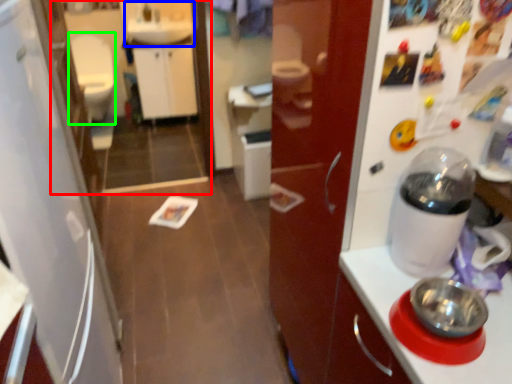
Question: Estimate the real-world distances between objects in this image. Which object is farther from mirror (highlighted by a red box), sink (highlighted by a blue box) or toilet bowl (highlighted by a green box)?

Choices:
 (A) sink
 (B) toilet bowl

Answer: (B)